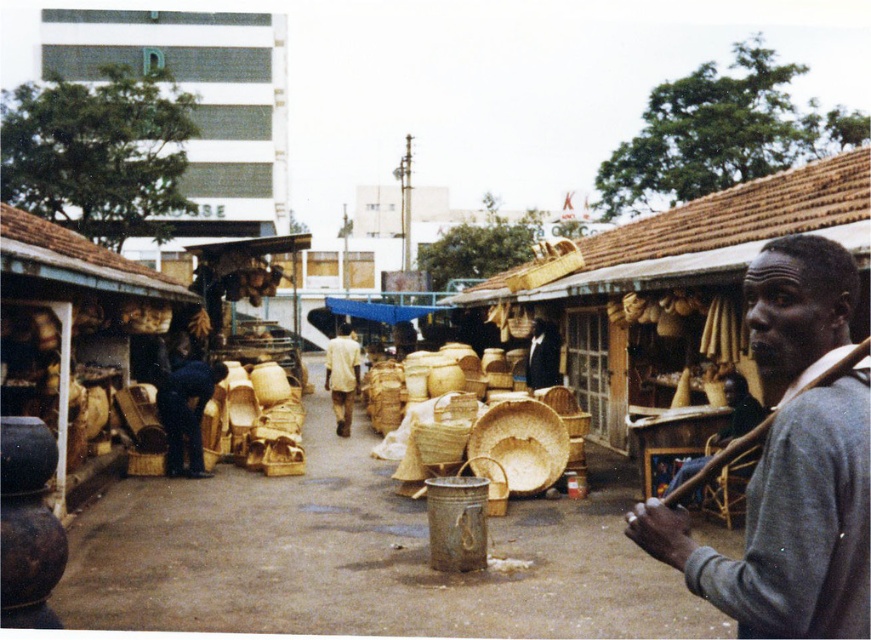
You are a customer at the market and want to pick up the gray wool sweater at center and the light brown woven basket at center. Which one should you move first if you want to grab the sweater first?

You should move the gray wool sweater at center first since it is already on the right side of the light brown woven basket at center, so you can reach it without disturbing the basket.

You are standing at the center of the market and want to take a photo of both the point at coordinates (849, 470) and the point at coordinates (341, 385). Considering their positions relative to you, which point should you focus on first to ensure both are in clear view?

You should focus on point (849, 470) first because it is closer to you than point (341, 385), ensuring both points are in clear view by starting with the nearer one.

You are a customer at the market and want to buy the gray wool sweater at center. Where exactly should you look to find it?

The gray wool sweater at center is located at point (791, 461).